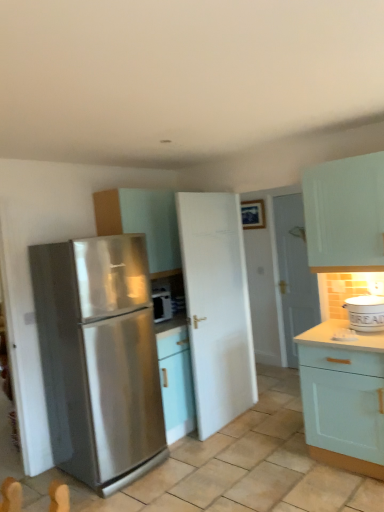
Question: Does matte white cabinet at center, acting as the first cabinetry starting from the left, touch white glossy door at center, positioned as the 2th door in left-to-right order?

Choices:
 (A) yes
 (B) no

Answer: (B)

Question: Can you confirm if matte white cabinet at center, which is the first cabinetry from top to bottom, is positioned to the right of white glossy door at center, which is the second door from front to back?

Choices:
 (A) yes
 (B) no

Answer: (B)

Question: Is matte white cabinet at center, which is counted as the 1th cabinetry, starting from the back, smaller than white glossy door at center, the 1th door positioned from the back?

Choices:
 (A) no
 (B) yes

Answer: (A)

Question: Is matte white cabinet at center, which is the first cabinetry from top to bottom, thinner than white glossy door at center, positioned as the 2th door in left-to-right order?

Choices:
 (A) no
 (B) yes

Answer: (A)

Question: Does matte white cabinet at center, acting as the second cabinetry starting from the right, contain white glossy door at center, the 1th door positioned from the back?

Choices:
 (A) no
 (B) yes

Answer: (A)

Question: Based on their sizes in the image, would you say matte white cabinet at center, which is counted as the 1th cabinetry, starting from the back, is bigger or smaller than light teal wood cabinet at lower right, which is the second cabinetry in left-to-right order?

Choices:
 (A) big
 (B) small

Answer: (B)

Question: From the image's perspective, relative to light teal wood cabinet at lower right, marked as the first cabinetry in a front-to-back arrangement, is matte white cabinet at center, arranged as the second cabinetry when viewed from the front, above or below?

Choices:
 (A) above
 (B) below

Answer: (A)

Question: From a real-world perspective, is matte white cabinet at center, arranged as the second cabinetry when viewed from the front, positioned above or below light teal wood cabinet at lower right, marked as the first cabinetry in a front-to-back arrangement?

Choices:
 (A) above
 (B) below

Answer: (A)

Question: Would you say matte white cabinet at center, which is the first cabinetry from top to bottom, is to the left or to the right of light teal wood cabinet at lower right, arranged as the 2th cabinetry when viewed from the back, in the picture?

Choices:
 (A) right
 (B) left

Answer: (B)

Question: Is stainless steel refrigerator at left spatially inside matte white cabinet at center, acting as the first cabinetry starting from the left, or outside of it?

Choices:
 (A) inside
 (B) outside

Answer: (B)

Question: Considering their positions, is stainless steel refrigerator at left located in front of or behind matte white cabinet at center, acting as the first cabinetry starting from the left?

Choices:
 (A) front
 (B) behind

Answer: (A)

Question: Considering the positions of stainless steel refrigerator at left and matte white cabinet at center, which is counted as the 1th cabinetry, starting from the back, in the image, is stainless steel refrigerator at left bigger or smaller than matte white cabinet at center, which is counted as the 1th cabinetry, starting from the back,?

Choices:
 (A) small
 (B) big

Answer: (B)

Question: Is point (117, 303) positioned closer to the camera than point (140, 219)?

Choices:
 (A) farther
 (B) closer

Answer: (B)

Question: Looking at the image, does white matte door at center, which is counted as the 1th door, starting from the left, seem bigger or smaller compared to white glossy door at center, which is the second door from front to back?

Choices:
 (A) small
 (B) big

Answer: (B)

Question: Considering the positions of point (236, 226) and point (288, 310), is point (236, 226) closer or farther from the camera than point (288, 310)?

Choices:
 (A) closer
 (B) farther

Answer: (A)